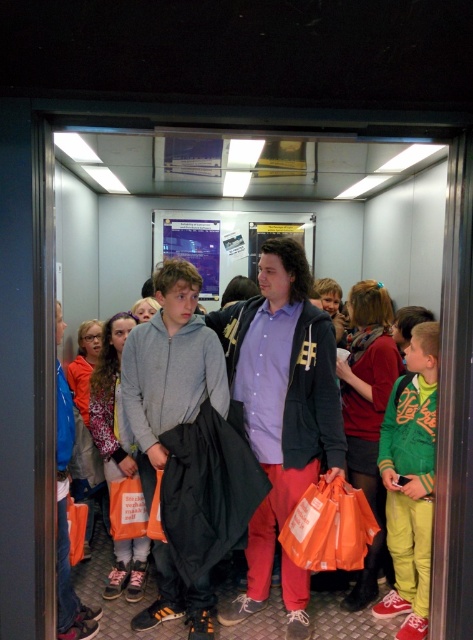
Question: Is matte gray hoodie at center above orange fabric jacket at left?

Choices:
 (A) no
 (B) yes

Answer: (A)

Question: Is green fleece jacket at right in front of matte gray hoodie at center?

Choices:
 (A) yes
 (B) no

Answer: (A)

Question: Is green fleece jacket at right positioned behind orange fabric jacket at left?

Choices:
 (A) no
 (B) yes

Answer: (A)

Question: Which point is farther to the camera?

Choices:
 (A) (103, 472)
 (B) (409, 374)
 (C) (130, 568)
 (D) (376, 404)

Answer: (A)

Question: Based on their relative distances, which object is farther from the matte orange bag at center?

Choices:
 (A) matte gray hoodie at center
 (B) orange fabric jacket at left
 (C) green fleece jacket at right

Answer: (B)

Question: Which point is farther to the camera?

Choices:
 (A) (374, 284)
 (B) (417, 608)

Answer: (A)